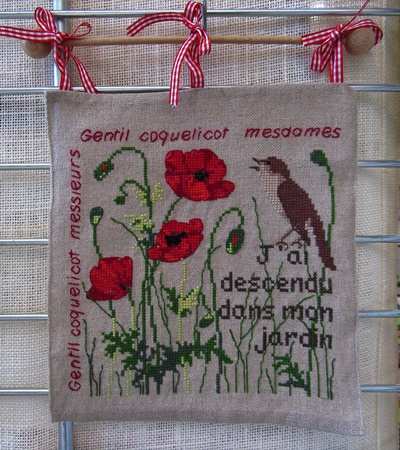
I want to click on dowel knobs, so click(30, 49), click(355, 39).